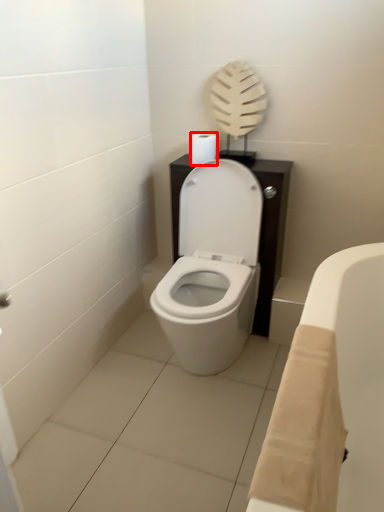
Question: Considering the relative positions of toilet paper (annotated by the red box) and bath in the image provided, where is toilet paper (annotated by the red box) located with respect to the staircase?

Choices:
 (A) right
 (B) left

Answer: (B)